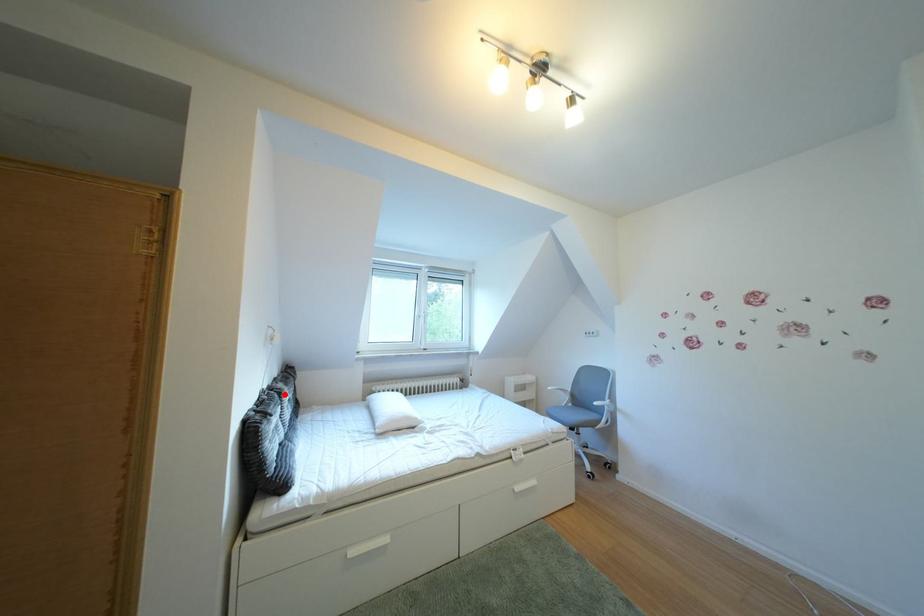
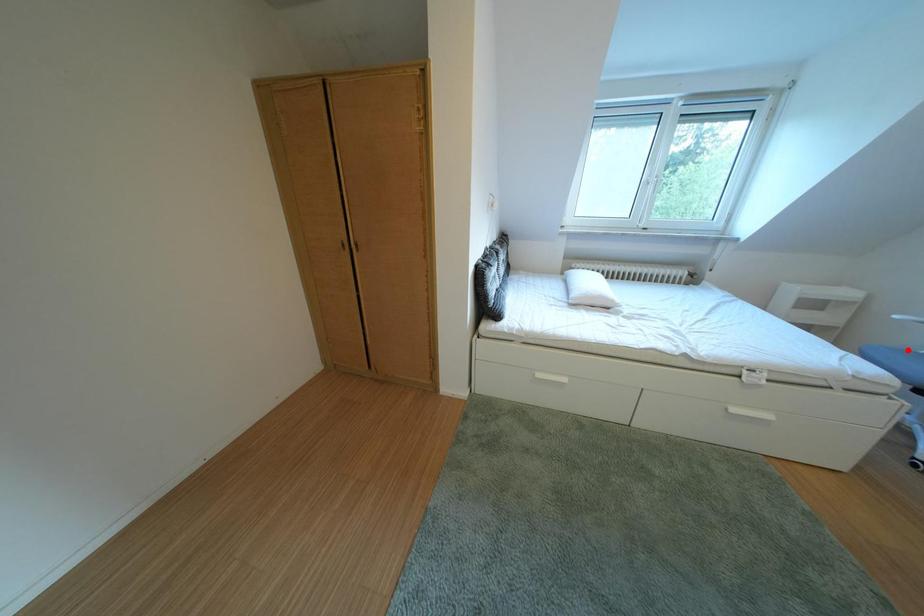
I am providing you with two images of the same scene from different viewpoints. A red point is marked on the first image and another point is marked on the second image. Is the marked point in image1 the same physical position as the marked point in image2?

No